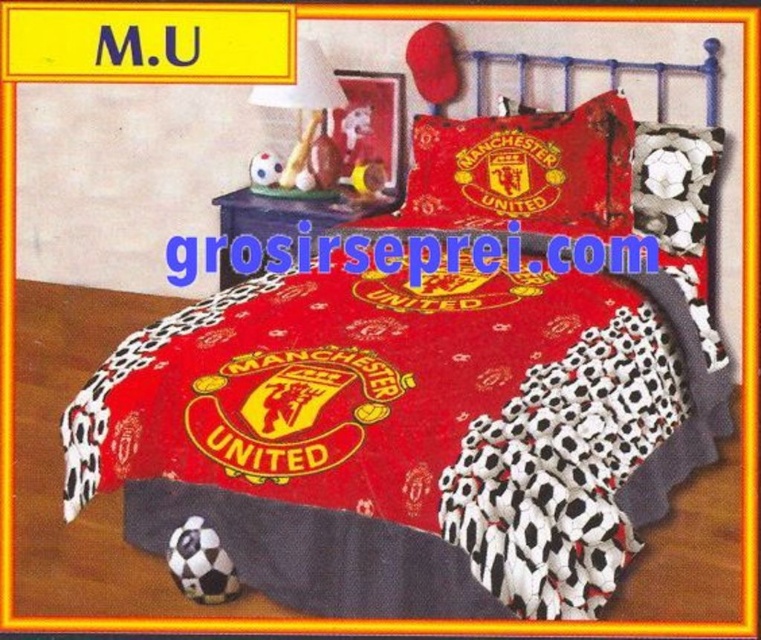
You are standing at the foot of the bed in the bedroom scene. You notice two points marked in the image. The first point is at coordinate point (x=449, y=168) and the second is at point (x=317, y=61). If you want to reach the point that is closer to you, which coordinate should you move towards?

Point (x=449, y=168) is in front of point (x=317, y=61), so you should move towards point (x=449, y=168) as it is closer to your current position at the foot of the bed.